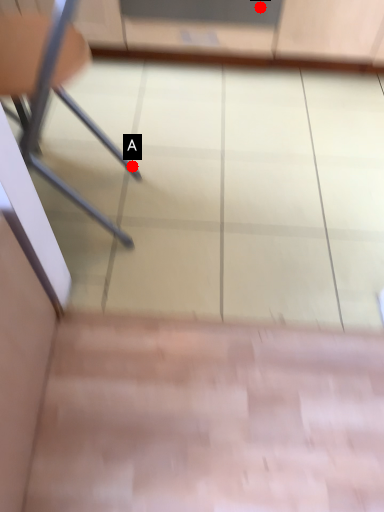
Question: Two points are circled on the image, labeled by A and B beside each circle. Which of the following is the farthest from the observer?

Choices:
 (A) A is further
 (B) B is further

Answer: (B)